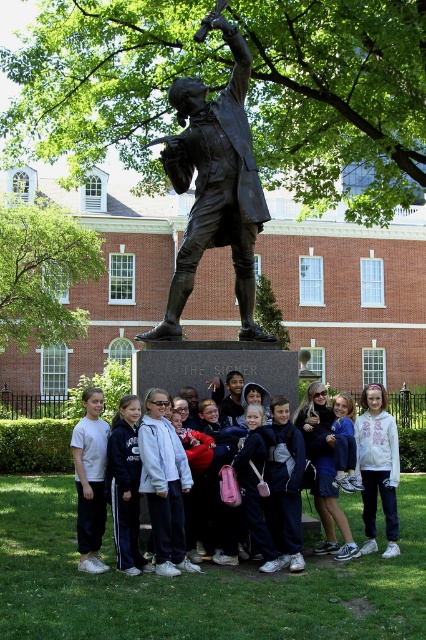
In the scene shown: You are a photographer trying to capture a closeup of the matte black jacket at center. The camera you are using has a focus point at coordinate point (327, 465). Will the matte black jacket at center be in focus?

The matte black jacket at center is located at point (327, 465), so yes, the matte black jacket at center will be in focus since the focus point is exactly at its location.

You are a photographer trying to adjust the focus on your camera. You notice two children in the foreground wearing a matte black jacket at center and a white fleece hoodie at center. Which clothing item is positioned higher on the child, making it easier to focus on?

The matte black jacket at center is located above the white fleece hoodie at center, so it is positioned higher and easier to focus on.